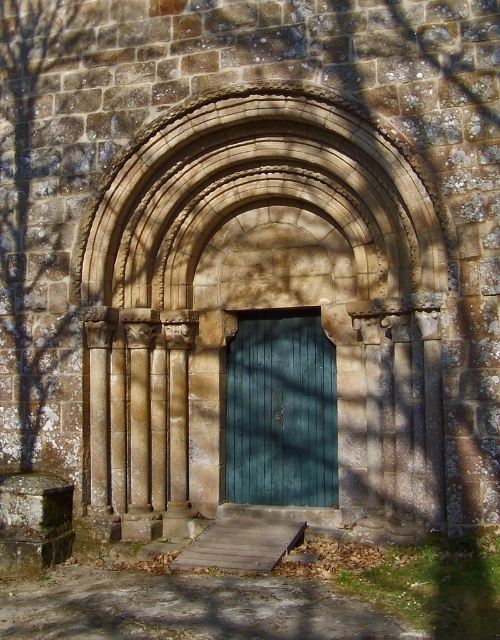
Can you confirm if stone textured arch at center is positioned to the right of teal wooden door at center?

No, stone textured arch at center is not to the right of teal wooden door at center.

Between point (278, 144) and point (301, 358), which one is positioned in front?

Point (278, 144) is more forward.

The width and height of the screenshot is (500, 640). What are the coordinates of `stone textured arch at center` in the screenshot? It's located at (260, 196).